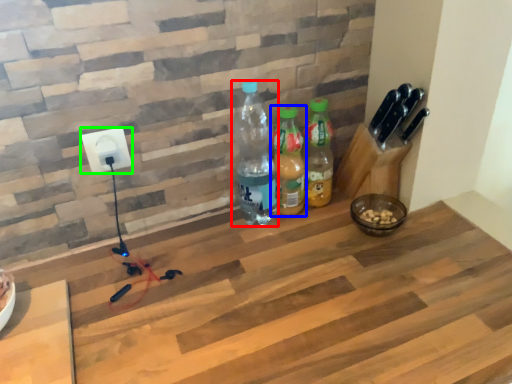
Question: Which object is positioned closest to bottle (highlighted by a red box)? Select from bottle (highlighted by a blue box) and power plugs and sockets (highlighted by a green box).

Choices:
 (A) bottle
 (B) power plugs and sockets

Answer: (A)